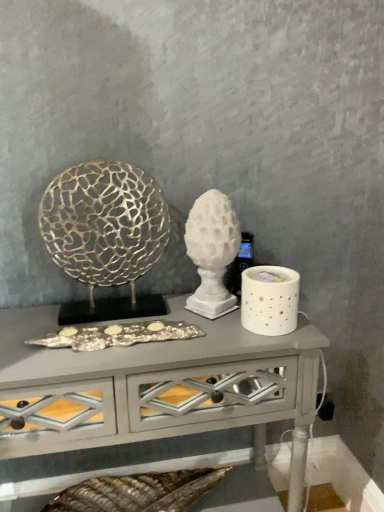
Where is `blank space situated above white glossy table at center (from a real-world perspective)`? This screenshot has width=384, height=512. blank space situated above white glossy table at center (from a real-world perspective) is located at coordinates (92, 322).